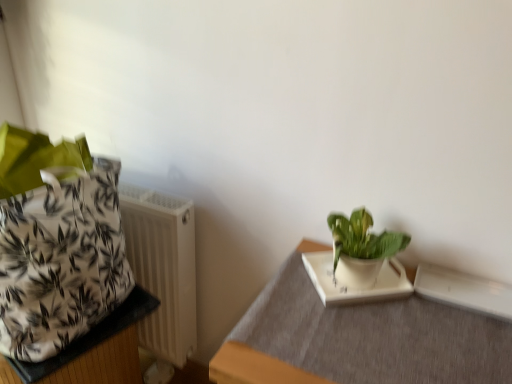
Question: Can you confirm if green glossy plant at upper right is bigger than white matte tray at lower right, which is the first table from right to left?

Choices:
 (A) no
 (B) yes

Answer: (A)

Question: Is green glossy plant at upper right not inside white matte tray at lower right, which is the second table in left-to-right order?

Choices:
 (A) yes
 (B) no

Answer: (A)

Question: Is green glossy plant at upper right further to the viewer compared to white matte tray at lower right, which is the second table in left-to-right order?

Choices:
 (A) no
 (B) yes

Answer: (B)

Question: Is green glossy plant at upper right to the left of white matte tray at lower right, which is the first table from right to left, from the viewer's perspective?

Choices:
 (A) no
 (B) yes

Answer: (B)

Question: Is green glossy plant at upper right in front of white matte tray at lower right, which is the first table from right to left?

Choices:
 (A) yes
 (B) no

Answer: (B)

Question: Is green glossy plant at upper right facing towards white matte tray at lower right, which is the second table in left-to-right order?

Choices:
 (A) yes
 (B) no

Answer: (B)

Question: Would you say white plastic radiator at left is outside white fabric bag at left, the 1th table from the left?

Choices:
 (A) no
 (B) yes

Answer: (B)

Question: Is white plastic radiator at left shorter than white fabric bag at left, the 1th table from the left?

Choices:
 (A) no
 (B) yes

Answer: (A)

Question: From the image's perspective, does white plastic radiator at left appear higher than white fabric bag at left, the 1th table from the left?

Choices:
 (A) yes
 (B) no

Answer: (A)

Question: Is white plastic radiator at left taller than white fabric bag at left, which is the 2th table from right to left?

Choices:
 (A) yes
 (B) no

Answer: (A)

Question: From the image's perspective, is white plastic radiator at left under white fabric bag at left, which is the 2th table from right to left?

Choices:
 (A) yes
 (B) no

Answer: (B)

Question: Can you confirm if white plastic radiator at left is positioned to the left of white fabric bag at left, which is the 2th table from right to left?

Choices:
 (A) no
 (B) yes

Answer: (A)

Question: Is white plastic radiator at left at the right side of green glossy plant at upper right?

Choices:
 (A) yes
 (B) no

Answer: (B)